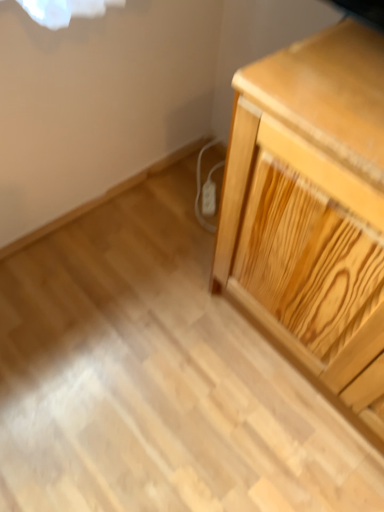
Locate an element on the screen. The height and width of the screenshot is (512, 384). free area behind white plastic electric outlet at lower center is located at coordinates (201, 167).